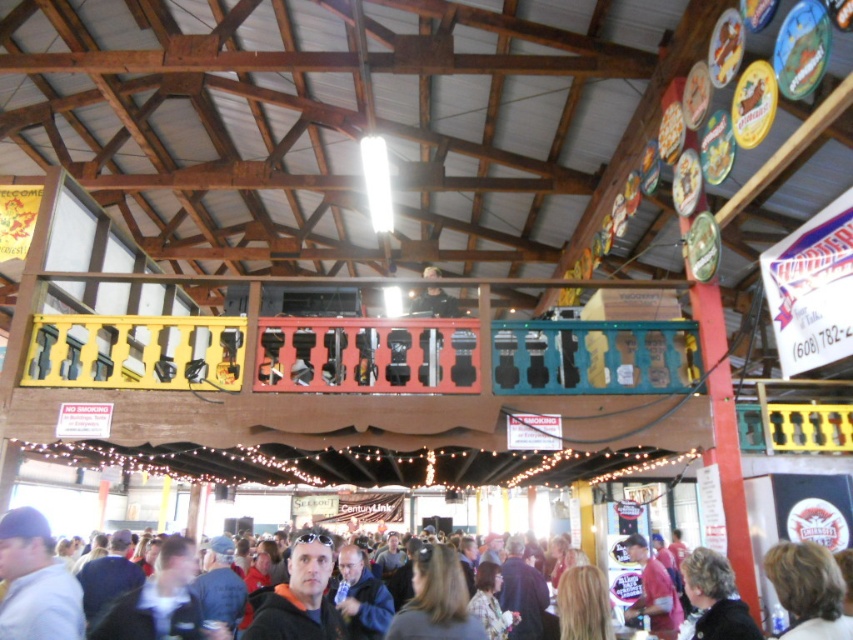
You are at the event and want to locate the person wearing the dark blue jacket at center and the light blue baseball cap at lower left. Which object is positioned more to the left?

The dark blue jacket at center is positioned to the left of the light blue baseball cap at lower left, so the dark blue jacket at center is more to the left.

You are a photographer at the event and want to capture both the dark blue jacket at center and the light blue baseball cap at lower left in the same photo. Given that your camera has a maximum focus range of 1.5 inches, will you be able to include both subjects in the photo?

The dark blue jacket at center and the light blue baseball cap at lower left are 1.42 inches apart from each other. Since the distance between them is within the camera maximum focus range of 1.5 inches, both subjects can be captured in the same photo.

You are at the event and want to take a photo of the light blue baseball cap at lower left without including the dark blue jacket at center in the frame. Is this possible based on their positions?

The dark blue jacket at center is further to the viewer than the light blue baseball cap at lower left. Since the jacket is closer, it may block the view of the cap, making it difficult to capture the cap without the jacket in the frame.